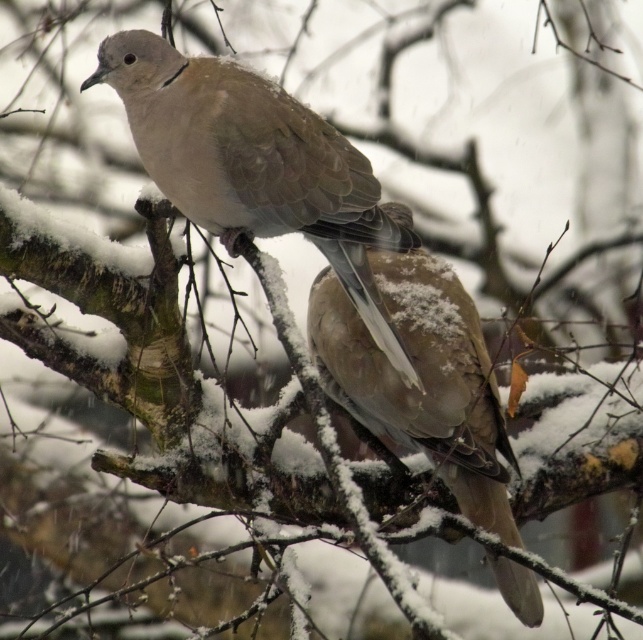
Question: Which object appears farthest from the camera in this image?

Choices:
 (A) matte brown dove at center
 (B) fuzzy brown pigeon at center

Answer: (B)

Question: Can you confirm if matte brown dove at center is smaller than fuzzy brown pigeon at center?

Choices:
 (A) no
 (B) yes

Answer: (A)

Question: Is matte brown dove at center bigger than fuzzy brown pigeon at center?

Choices:
 (A) no
 (B) yes

Answer: (B)

Question: Where is matte brown dove at center located in relation to fuzzy brown pigeon at center in the image?

Choices:
 (A) right
 (B) left

Answer: (B)

Question: Which point is closer to the camera?

Choices:
 (A) matte brown dove at center
 (B) fuzzy brown pigeon at center

Answer: (A)